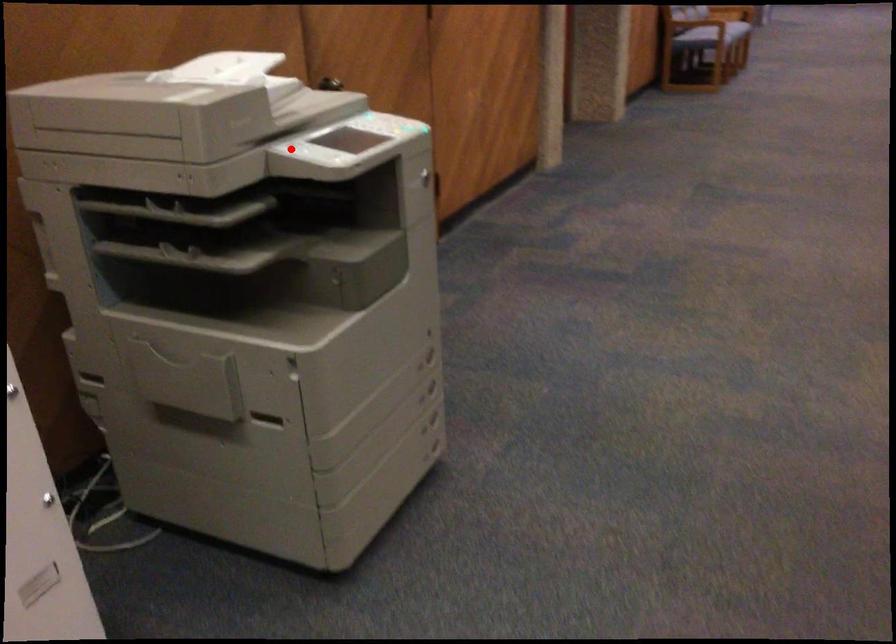
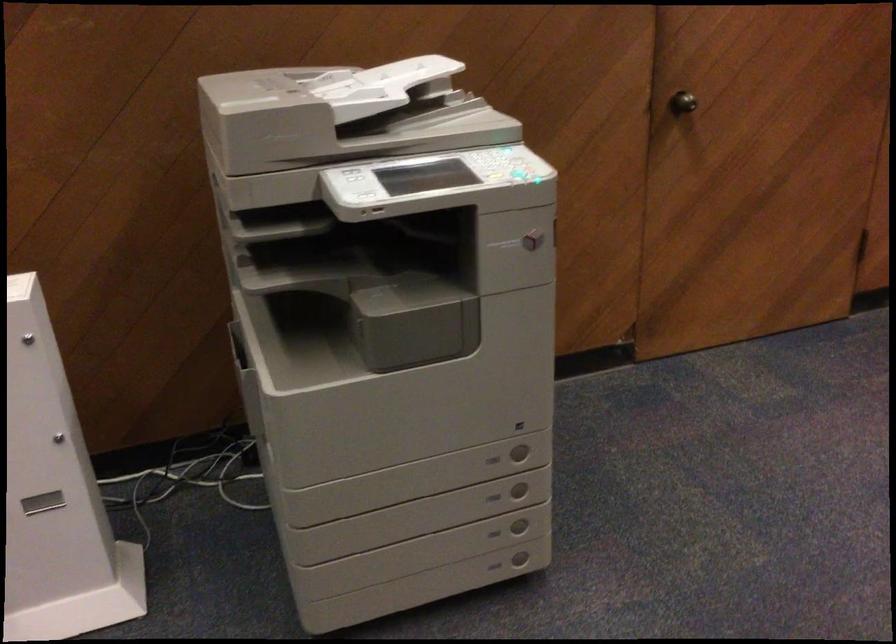
Find the pixel in the second image that matches the highlighted location in the first image.

(354, 175)